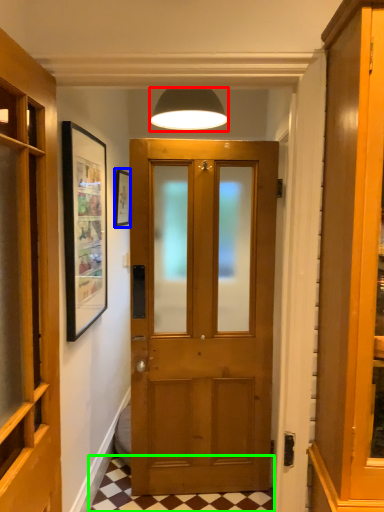
Question: Estimate the real-world distances between objects in this image. Which object is farther from lamp (highlighted by a red box), picture frame (highlighted by a blue box) or tile (highlighted by a green box)?

Choices:
 (A) picture frame
 (B) tile

Answer: (B)